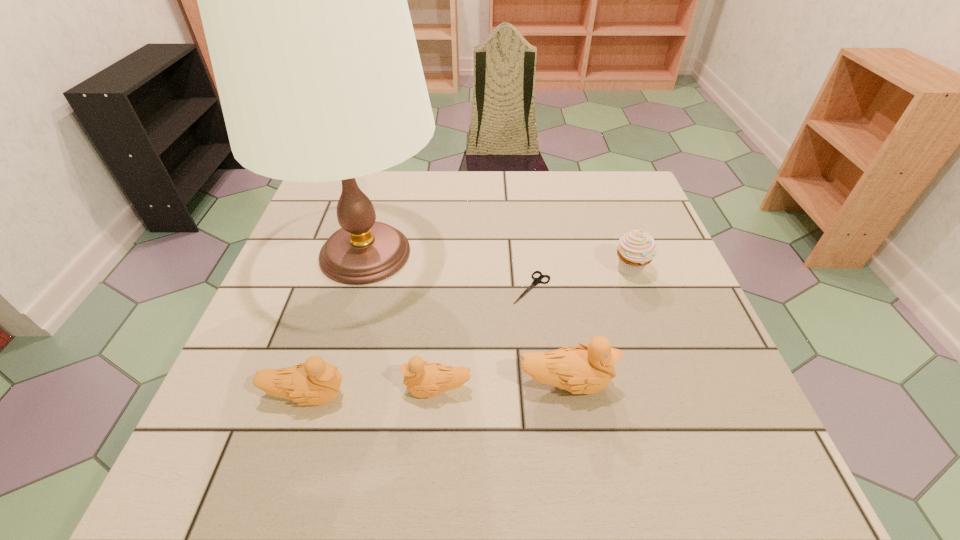
Please point a spot on the right to add another duckling. Please provide its 2D coordinates. Your answer should be formatted as a tuple, i.e. [(x, y)], where the tuple contains the x and y coordinates of a point satisfying the conditions above.

[(690, 378)]